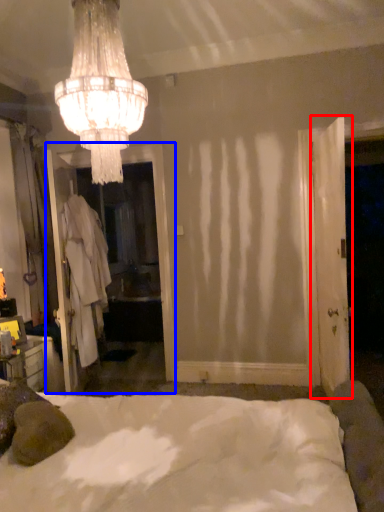
Question: Which point is further to the camera, door (highlighted by a red box) or screen door (highlighted by a blue box)?

Choices:
 (A) door
 (B) screen door

Answer: (B)